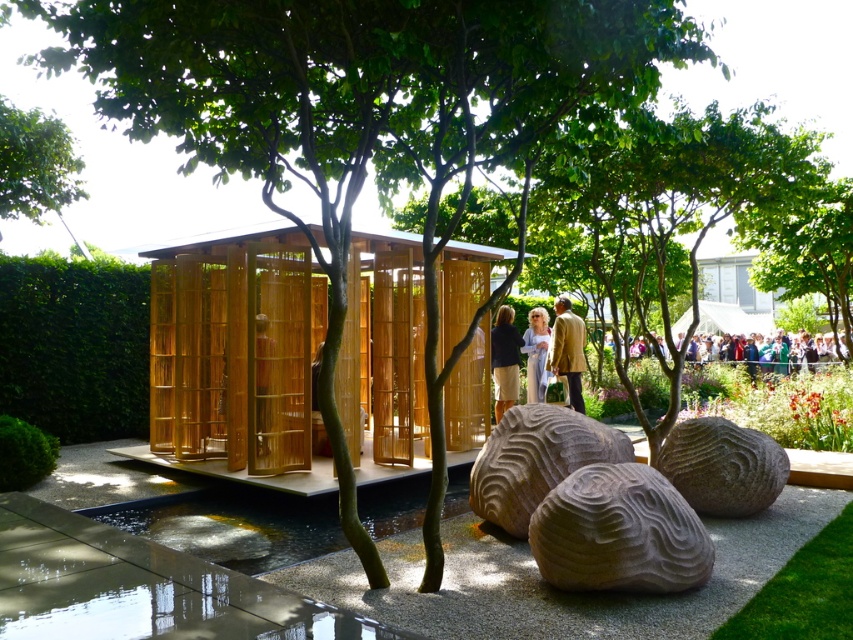
Question: Considering the real-world distances, which object is closest to the green leafy tree at upper left?

Choices:
 (A) green leafy hedge at left
 (B) gray stone boulder at center
 (C) green leafy tree at upper right

Answer: (A)

Question: Can you confirm if natural wood hut at center is smaller than gray stone boulder at center-right?

Choices:
 (A) yes
 (B) no

Answer: (B)

Question: Does green leafy tree at upper left appear on the right side of gold textured jacket at center?

Choices:
 (A) yes
 (B) no

Answer: (B)

Question: Which object is closer to the camera taking this photo?

Choices:
 (A) gray stone boulder at center-right
 (B) gray stone boulder at center
 (C) dark brown leather jacket at center
 (D) natural wood hut at center

Answer: (B)

Question: Which point is closer to the camera?

Choices:
 (A) (564, 333)
 (B) (740, 448)
 (C) (527, 387)

Answer: (B)

Question: Does brown textured rock at center appear under green leafy tree at upper right?

Choices:
 (A) yes
 (B) no

Answer: (A)